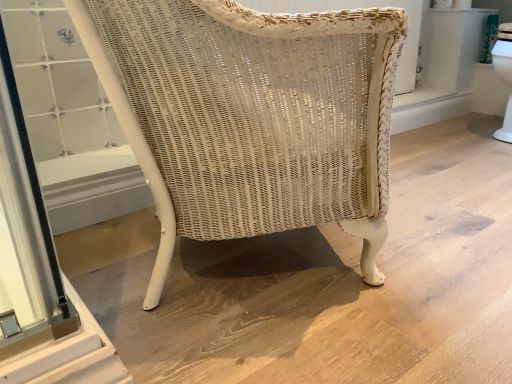
This screenshot has width=512, height=384. Identify the location of vacant area that lies to the right of white wicker chair at center. (439, 244).